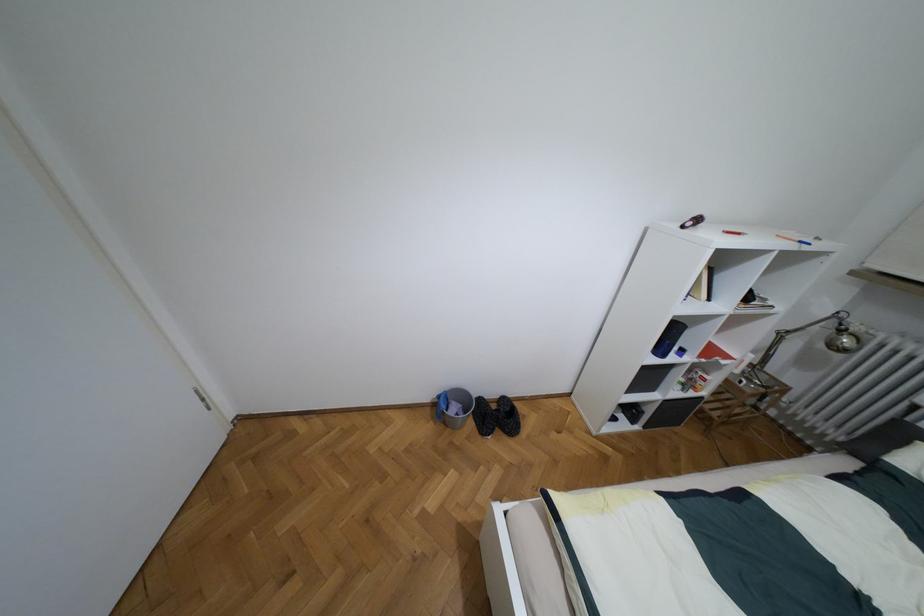
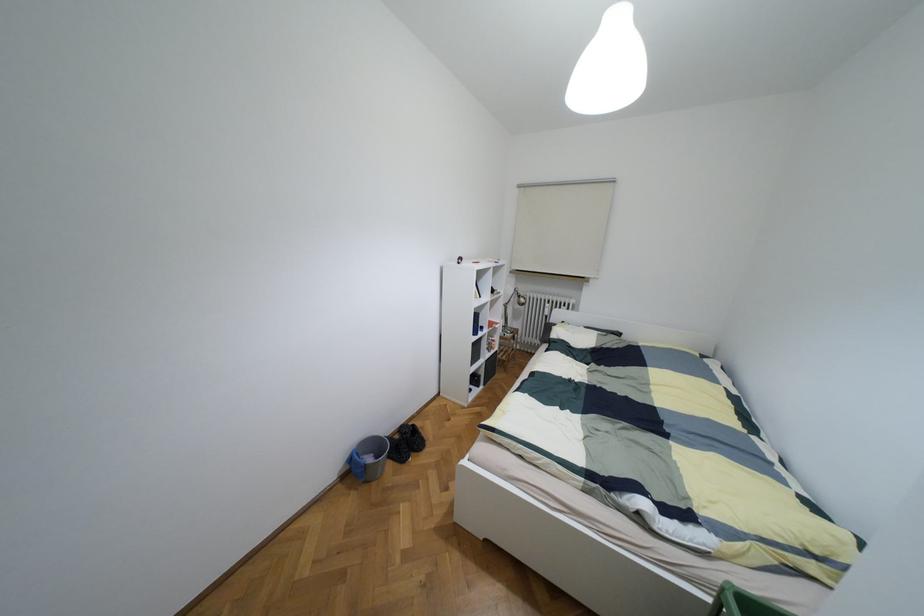
Question: I am providing you with two images of the same scene from different viewpoints. Which of the following objects are not visible in image2?

Choices:
 (A) blue bottle
 (B) white book
 (C) silver lamp head
 (D) none of these

Answer: (D)